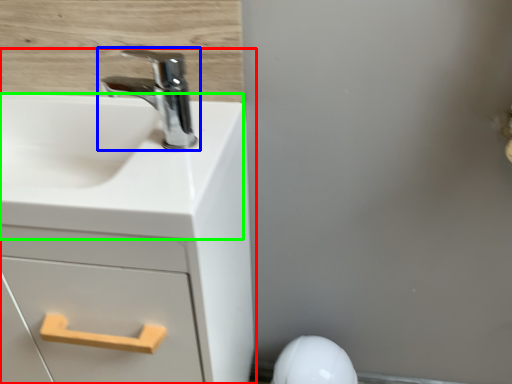
Question: Which object is positioned farthest from bathroom cabinet (highlighted by a red box)? Select from tap (highlighted by a blue box) and counter top (highlighted by a green box).

Choices:
 (A) tap
 (B) counter top

Answer: (A)